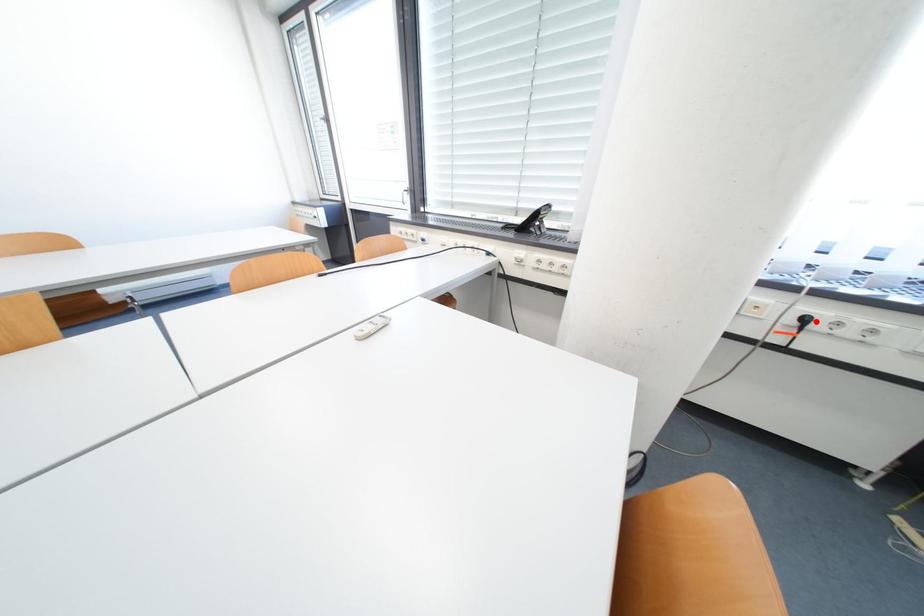
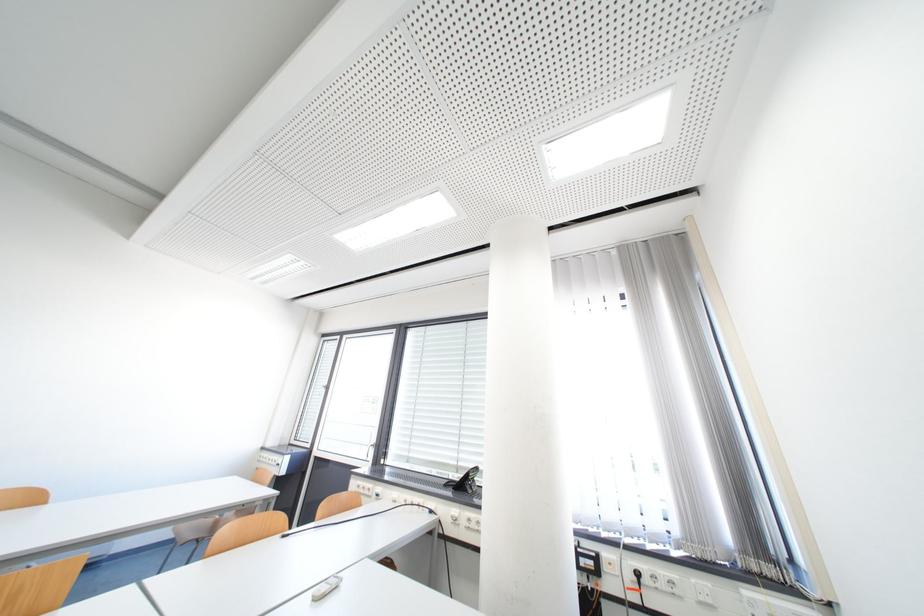
The point at the highlighted location is marked in the first image. Where is the corresponding point in the second image?

(649, 576)